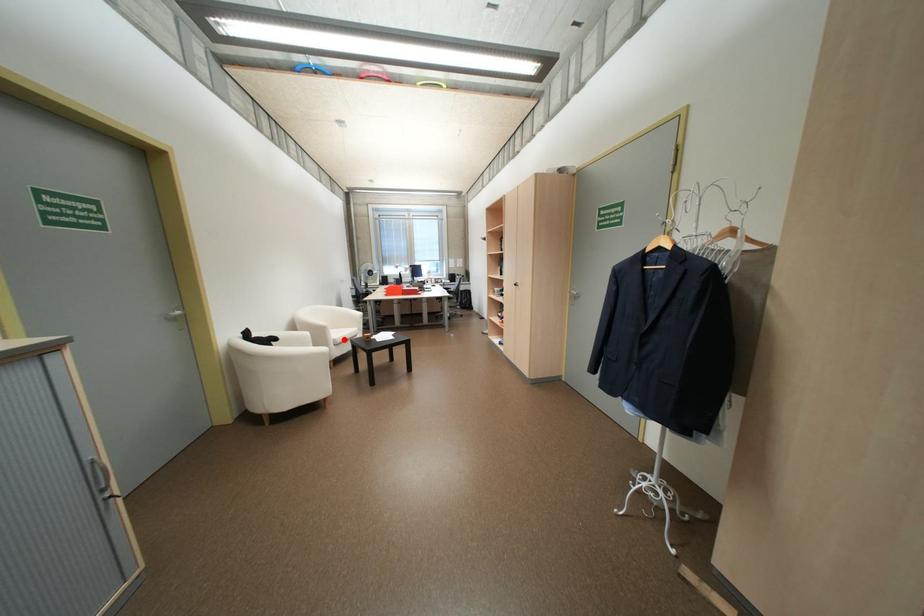
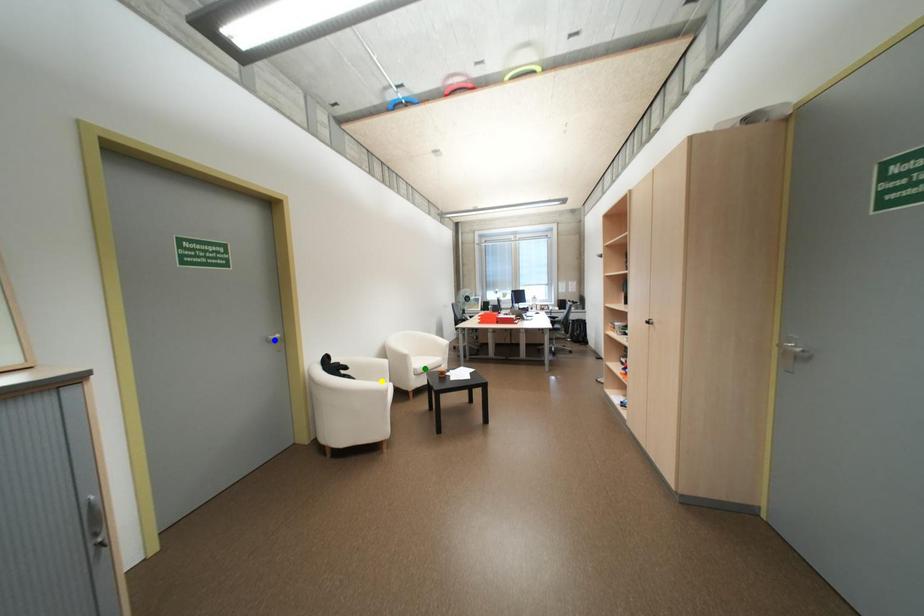
Question: I am providing you with two images of the same scene from different viewpoints. A red point is marked on the first image. You are given multiple points on the second image. Which point in image 2 represents the same 3d spot as the red point in image 1?

Choices:
 (A) yellow point
 (B) blue point
 (C) green point

Answer: (C)